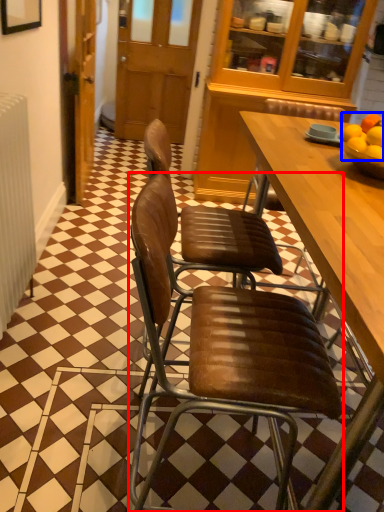
Question: Which object appears closest to the camera in this image, chair (highlighted by a red box) or fruit (highlighted by a blue box)?

Choices:
 (A) chair
 (B) fruit

Answer: (A)